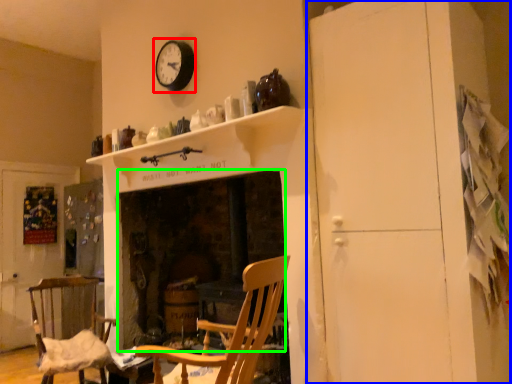
Question: Estimate the real-world distances between objects in this image. Which object is closer to clock (highlighted by a red box), dresser (highlighted by a blue box) or fireplace (highlighted by a green box)?

Choices:
 (A) dresser
 (B) fireplace

Answer: (B)